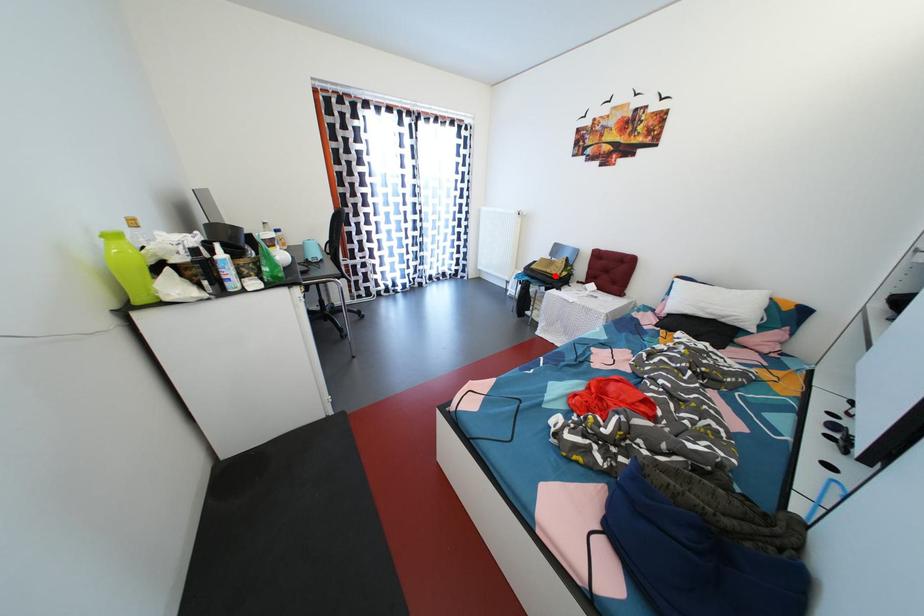
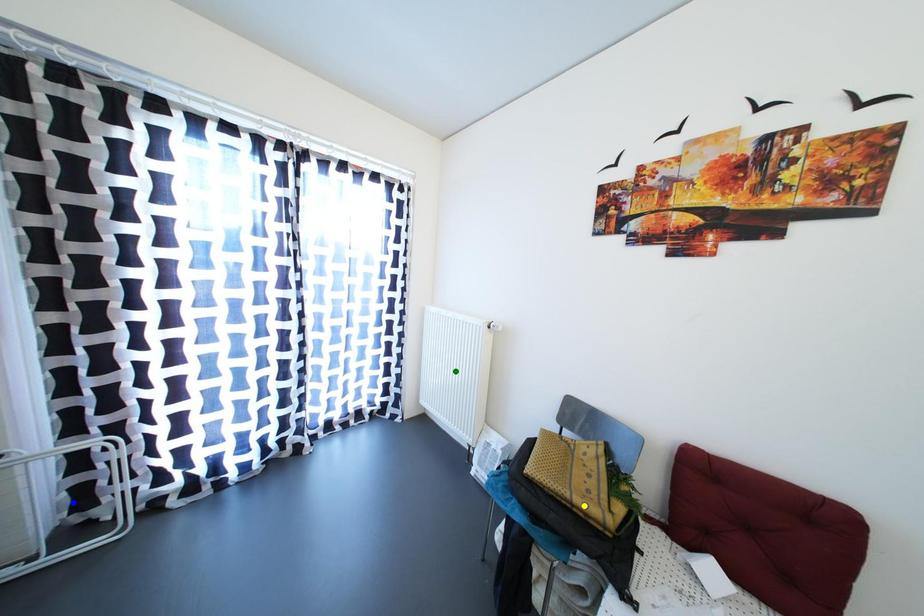
Question: I am providing you with two images of the same scene from different viewpoints. A red point is marked on the first image. You are given multiple points on the second image. Which mark in image 2 goes with the point in image 1?

Choices:
 (A) blue point
 (B) green point
 (C) yellow point

Answer: (C)